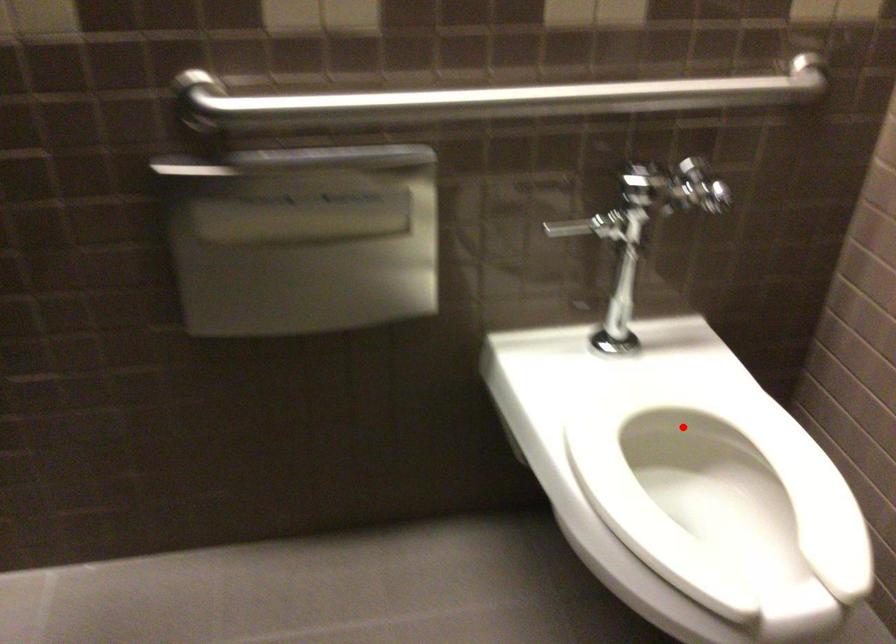
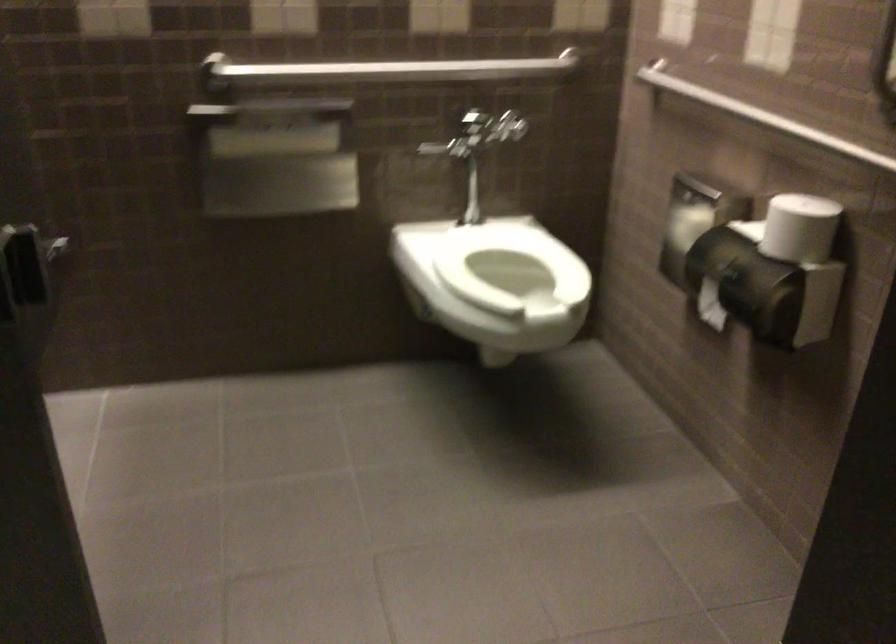
Question: I am providing you with two images of the same scene from different viewpoints. Given a red point in image1, look at the same physical point in image2. Is it:

Choices:
 (A) Closer to the viewpoint
 (B) Farther from the viewpoint

Answer: (B)